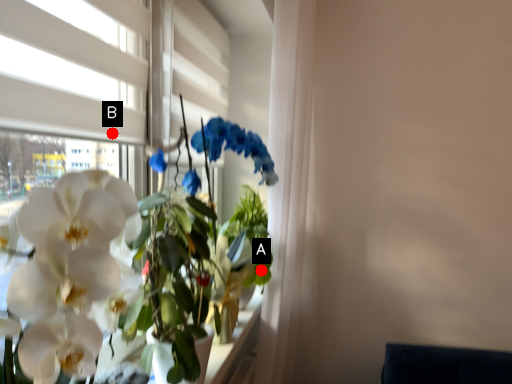
Question: Two points are circled on the image, labeled by A and B beside each circle. Which point appears closest to the camera in this image?

Choices:
 (A) A is closer
 (B) B is closer

Answer: (B)